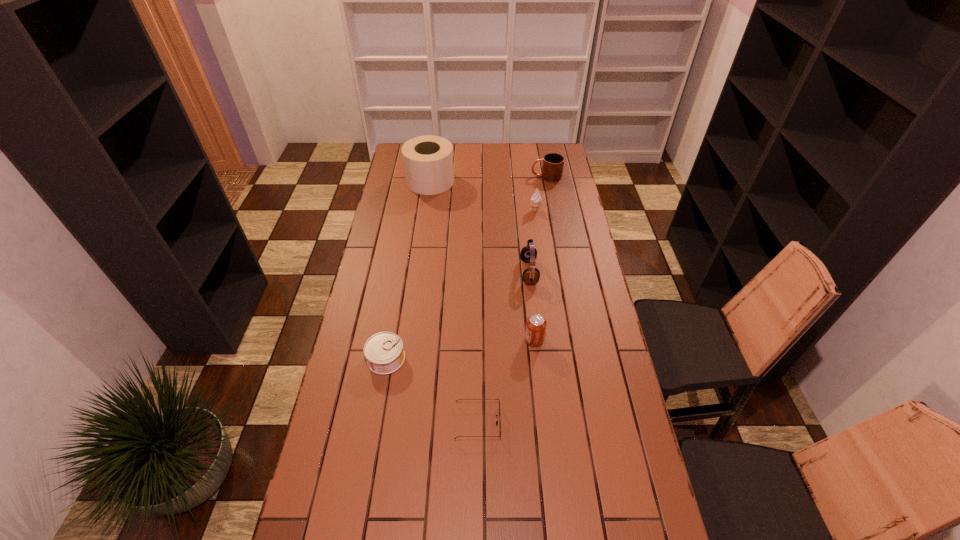
You are a GUI agent. You are given a task and a screenshot of the screen. Output one action in this format:
    pyautogui.click(x=<x>, y=<y>)
    Task: Click on the vacant space located 0.080m on the ear cups of the fourth farthest object
    
    Given the screenshot: What is the action you would take?
    pyautogui.click(x=500, y=272)

The width and height of the screenshot is (960, 540). In order to click on vacant space located on the ear cups of the fourth farthest object in this screenshot , I will do `click(506, 272)`.

What are the coordinates of `vacant space located on the ear cups of the fourth farthest object` in the screenshot? It's located at (495, 272).

Find the location of a particular element. The height and width of the screenshot is (540, 960). vacant space located on the front-facing side of the third farthest object is located at coordinates (490, 211).

At what (x,y) coordinates should I click in order to perform the action: click on blank space located 0.120m on the front-facing side of the third farthest object. Please return your answer as a coordinate pair (x, y). Looking at the image, I should click on (503, 211).

This screenshot has width=960, height=540. I want to click on blank space located on the front-facing side of the third farthest object, so click(503, 211).

This screenshot has height=540, width=960. I want to click on vacant space located 0.060m on the right of the right can, so click(562, 340).

Where is `free spot located 0.050m on the side of the mug with the handle`? The image size is (960, 540). free spot located 0.050m on the side of the mug with the handle is located at coordinates (520, 176).

The height and width of the screenshot is (540, 960). I want to click on vacant space positioned 0.320m on the side of the mug with the handle, so click(467, 176).

Find the location of a particular element. The width and height of the screenshot is (960, 540). free space located 0.080m on the side of the mug with the handle is located at coordinates (515, 176).